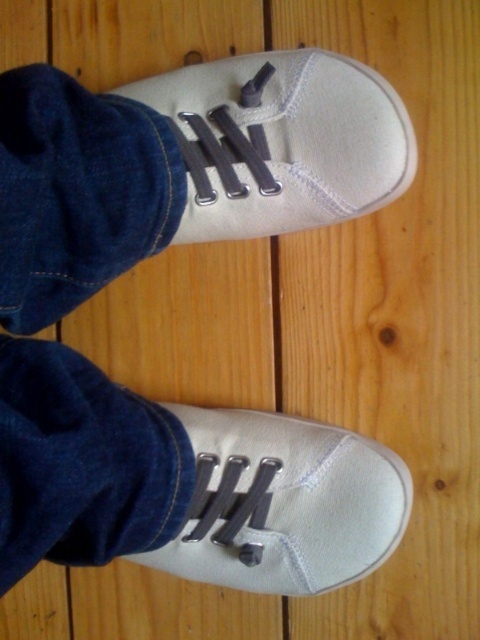
You are trying to decide which white canvas shoe to wear today. You notice that the white canvas shoe at upper center and the white canvas shoe at lower center are different in height. Which one is taller?

The white canvas shoe at upper center is much taller than the white canvas shoe at lower center.

You are a photographer trying to capture both the white canvas shoe at upper center and the white canvas shoe at lower center in a single frame. Based on their sizes in the image, which shoe should you focus on first to ensure both fit properly in the photo?

The white canvas shoe at upper center occupies less space than the white canvas shoe at lower center, so you should focus on the white canvas shoe at lower center first since it is larger and requires more attention to fit within the frame.